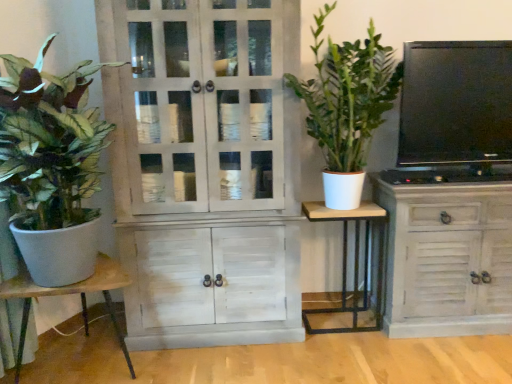
Find the location of `vacant area that lies between distressed white cabinet at right, the 2th cabinetry positioned from the left, and white wood table at center, which is the 1th table in right-to-left order`. vacant area that lies between distressed white cabinet at right, the 2th cabinetry positioned from the left, and white wood table at center, which is the 1th table in right-to-left order is located at coordinates (352, 326).